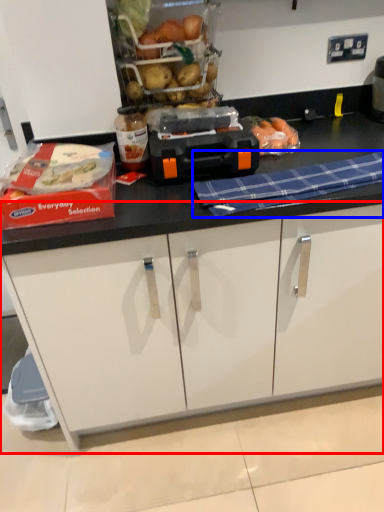
Question: Which object appears closest to the camera in this image, cabinetry (highlighted by a red box) or blanket (highlighted by a blue box)?

Choices:
 (A) cabinetry
 (B) blanket

Answer: (B)